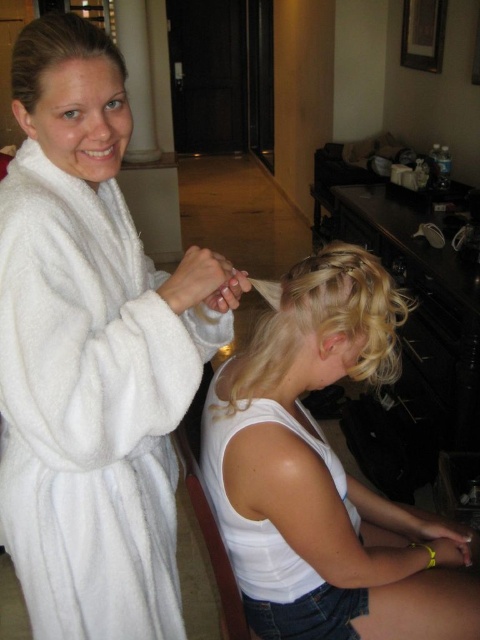
Can you confirm if blonde curly hair at center is positioned to the right of blonde silky hair at upper center?

Indeed, blonde curly hair at center is positioned on the right side of blonde silky hair at upper center.

Can you confirm if blonde curly hair at center is wider than blonde silky hair at upper center?

Yes, blonde curly hair at center is wider than blonde silky hair at upper center.

Identify the location of blonde curly hair at center. (321, 323).

This screenshot has width=480, height=640. Find the location of `blonde curly hair at center`. blonde curly hair at center is located at coordinates (321, 323).

Is white fluffy robe at left thinner than blonde hair at center?

Yes.

Consider the image. Is white fluffy robe at left positioned behind blonde hair at center?

No, it is in front of blonde hair at center.

Locate an element on the screen. white fluffy robe at left is located at coordinates (92, 353).

Does blonde hair at center come behind blonde silky hair at upper center?

Yes.

Locate an element on the screen. blonde hair at center is located at coordinates (324, 474).